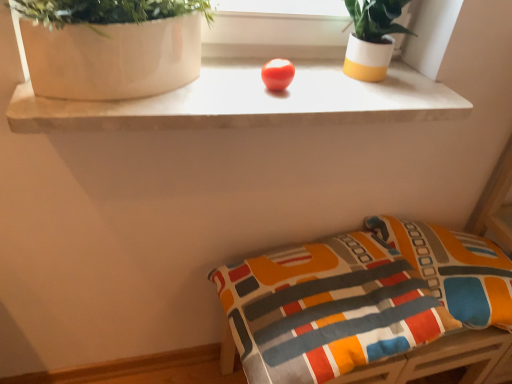
What is the approximate width of white/yellow ceramic pot at upper right?

It is 4.86 inches.

I want to click on matte white shelf at center, so click(x=249, y=102).

Find the location of `textured fabric pillow at lower right`. textured fabric pillow at lower right is located at coordinates coord(455,269).

Is white/yellow ceramic pot at upper right thinner than white glossy vase at upper left?

Yes.

Who is smaller, white/yellow ceramic pot at upper right or white glossy vase at upper left?

Smaller between the two is white/yellow ceramic pot at upper right.

Would you say white/yellow ceramic pot at upper right is to the left or to the right of white glossy vase at upper left in the picture?

From the image, it's evident that white/yellow ceramic pot at upper right is to the right of white glossy vase at upper left.

Which is behind, white/yellow ceramic pot at upper right or white glossy vase at upper left?

white/yellow ceramic pot at upper right.

Measure the distance from white/yellow ceramic pot at upper right to textured fabric cushion at lower right.

53.71 centimeters.

In the scene shown: Which of these two, white/yellow ceramic pot at upper right or textured fabric cushion at lower right, is thinner?

Thinner between the two is white/yellow ceramic pot at upper right.

Is white/yellow ceramic pot at upper right completely or partially outside of textured fabric cushion at lower right?

white/yellow ceramic pot at upper right lies outside textured fabric cushion at lower right's area.

Is white/yellow ceramic pot at upper right facing towards textured fabric cushion at lower right?

No, white/yellow ceramic pot at upper right is not facing towards textured fabric cushion at lower right.

This screenshot has height=384, width=512. In the image, there is a white/yellow ceramic pot at upper right. What are the coordinates of `vase below it (from the image's perspective)` in the screenshot? It's located at pyautogui.click(x=113, y=58).

Is white glossy vase at upper left at the right side of white/yellow ceramic pot at upper right?

In fact, white glossy vase at upper left is to the left of white/yellow ceramic pot at upper right.

Is white glossy vase at upper left not close to white/yellow ceramic pot at upper right?

Actually, white glossy vase at upper left and white/yellow ceramic pot at upper right are a little close together.

Which object is further away from the camera, textured fabric cushion at lower right or white/yellow ceramic pot at upper right?

white/yellow ceramic pot at upper right is more distant.

Where is `houseplant located above the textured fabric cushion at lower right (from a real-world perspective)`? houseplant located above the textured fabric cushion at lower right (from a real-world perspective) is located at coordinates (372, 37).

Is textured fabric cushion at lower right placed right next to white/yellow ceramic pot at upper right?

They are not placed beside each other.

Which of these two, textured fabric cushion at lower right or white/yellow ceramic pot at upper right, is smaller?

white/yellow ceramic pot at upper right is smaller.

Considering the positions of objects textured fabric cushion at lower right and matte white shelf at center in the image provided, who is in front, textured fabric cushion at lower right or matte white shelf at center?

Positioned in front is matte white shelf at center.

From the image's perspective, which is above, textured fabric cushion at lower right or matte white shelf at center?

matte white shelf at center, from the image's perspective.

Which is correct: textured fabric cushion at lower right is inside matte white shelf at center, or outside of it?

textured fabric cushion at lower right is spatially situated outside matte white shelf at center.

How many degrees apart are the facing directions of textured fabric pillow at lower right and matte white shelf at center?

They differ by 6 degrees in their facing directions.

Does textured fabric pillow at lower right come behind matte white shelf at center?

Yes, the depth of textured fabric pillow at lower right is greater than that of matte white shelf at center.

Between point (454, 280) and point (342, 100), which one is positioned behind?

The point (454, 280) is more distant.

Is textured fabric pillow at lower right oriented away from matte white shelf at center?

No, matte white shelf at center is not at the back of textured fabric pillow at lower right.

What's the angular difference between white/yellow ceramic pot at upper right and textured fabric pillow at lower right's facing directions?

6.72 degrees.

Is white/yellow ceramic pot at upper right far away from textured fabric pillow at lower right?

white/yellow ceramic pot at upper right is near textured fabric pillow at lower right, not far away.

Which object is closer to the camera taking this photo, white/yellow ceramic pot at upper right or textured fabric pillow at lower right?

white/yellow ceramic pot at upper right is more forward.

From a real-world perspective, which object stands above the other?

white/yellow ceramic pot at upper right is physically above.

Locate an element on the screen. vase beneath the white/yellow ceramic pot at upper right (from a real-world perspective) is located at coordinates (113, 58).

You are a GUI agent. You are given a task and a screenshot of the screen. Output one action in this format:
    pyautogui.click(x=<x>, y=<y>)
    Task: Click on the furniture on the left of white/yellow ceramic pot at upper right
    
    Given the screenshot: What is the action you would take?
    pyautogui.click(x=365, y=305)

Considering their positions, is textured fabric cushion at lower right positioned closer to textured fabric pillow at lower right than white/yellow ceramic pot at upper right?

textured fabric cushion at lower right.

Looking at the image, which one is located closer to textured fabric pillow at lower right, textured fabric cushion at lower right or matte white shelf at center?

Among the two, textured fabric cushion at lower right is located nearer to textured fabric pillow at lower right.

Based on their spatial positions, is textured fabric pillow at lower right or textured fabric cushion at lower right closer to white glossy vase at upper left?

textured fabric cushion at lower right is positioned closer to the anchor white glossy vase at upper left.

From the image, which object appears to be nearer to textured fabric cushion at lower right, white/yellow ceramic pot at upper right or textured fabric pillow at lower right?

The object closer to textured fabric cushion at lower right is textured fabric pillow at lower right.

When comparing their distances from matte white shelf at center, does white glossy vase at upper left or white/yellow ceramic pot at upper right seem closer?

white glossy vase at upper left is closer to matte white shelf at center.

In the scene shown: Considering their positions, is textured fabric cushion at lower right positioned further to matte white shelf at center than textured fabric pillow at lower right?

textured fabric pillow at lower right is further to matte white shelf at center.

Considering their positions, is white/yellow ceramic pot at upper right positioned further to white glossy vase at upper left than textured fabric pillow at lower right?

textured fabric pillow at lower right is further to white glossy vase at upper left.

From the picture: Considering their positions, is matte white shelf at center positioned closer to textured fabric pillow at lower right than white/yellow ceramic pot at upper right?

matte white shelf at center.

You are a GUI agent. You are given a task and a screenshot of the screen. Output one action in this format:
    pyautogui.click(x=<x>, y=<y>)
    Task: Click on the houseplant located between white glossy vase at upper left and textured fabric pillow at lower right in the left-right direction
    
    Given the screenshot: What is the action you would take?
    pyautogui.click(x=372, y=37)

Find the location of a particular element. table between white/yellow ceramic pot at upper right and textured fabric pillow at lower right from top to bottom is located at coordinates (249, 102).

Locate an element on the screen. This screenshot has width=512, height=384. table between white glossy vase at upper left and white/yellow ceramic pot at upper right from left to right is located at coordinates (249, 102).

Identify the location of table between white glossy vase at upper left and textured fabric cushion at lower right in the vertical direction. (249, 102).